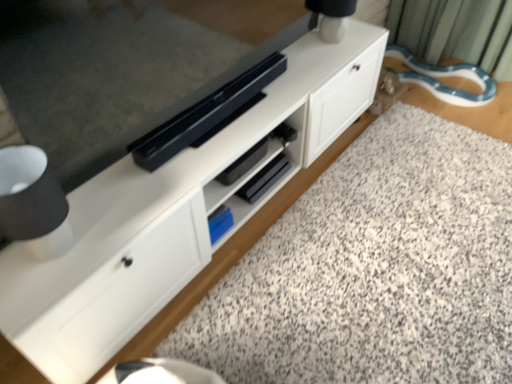
Identify the location of granite at lower center. (375, 270).

Identify the location of white matte cabinet at center. The image size is (512, 384). (178, 195).

What is the approximate width of white matte cabinet at center?

45.25 centimeters.

Describe the element at coordinates (332, 17) in the screenshot. The height and width of the screenshot is (384, 512). I see `white matte table lamp at upper right` at that location.

I want to click on granite at lower center, so click(375, 270).

Considering the relative sizes of granite at lower center and white matte cabinet at center in the image provided, is granite at lower center thinner than white matte cabinet at center?

Incorrect, the width of granite at lower center is not less than that of white matte cabinet at center.

Between granite at lower center and white matte cabinet at center, which one is positioned behind?

white matte cabinet at center.

Does granite at lower center appear on the left side of white matte cabinet at center?

In fact, granite at lower center is to the right of white matte cabinet at center.

Looking at this image, in terms of height, does granite at lower center look taller or shorter compared to white matte cabinet at center?

Considering their sizes, granite at lower center has less height than white matte cabinet at center.

Which of these two, white matte table lamp at upper right or granite at lower center, is bigger?

With larger size is granite at lower center.

Are white matte table lamp at upper right and granite at lower center beside each other?

They are not placed beside each other.

Does white matte table lamp at upper right have a lesser width compared to granite at lower center?

Yes.

You are a GUI agent. You are given a task and a screenshot of the screen. Output one action in this format:
    pyautogui.click(x=<x>, y=<y>)
    Task: Click on the granite in front of the white matte table lamp at upper right
    
    Given the screenshot: What is the action you would take?
    pyautogui.click(x=375, y=270)

Would you say granite at lower center is outside white matte table lamp at upper right?

Yes, granite at lower center is outside of white matte table lamp at upper right.

From a real-world perspective, is granite at lower center on top of white matte table lamp at upper right?

No, from a real-world perspective, granite at lower center is not above white matte table lamp at upper right.

Is granite at lower center at the right side of white matte table lamp at upper right?

Yes, granite at lower center is to the right of white matte table lamp at upper right.

Are white matte cabinet at center and white matte table lamp at upper right making contact?

white matte cabinet at center and white matte table lamp at upper right are not in contact.

Is white matte cabinet at center oriented towards white matte table lamp at upper right?

No, white matte cabinet at center is not turned towards white matte table lamp at upper right.

Which of these two, white matte cabinet at center or white matte table lamp at upper right, is wider?

white matte cabinet at center is wider.

Is white matte table lamp at upper right inside white matte cabinet at center?

Definitely not — white matte table lamp at upper right is not inside white matte cabinet at center.

From the picture: Could you tell me if white matte cabinet at center is facing granite at lower center?

Yes, white matte cabinet at center faces towards granite at lower center.

Could granite at lower center be considered to be inside white matte cabinet at center?

No, granite at lower center is not surrounded by white matte cabinet at center.

Is white matte cabinet at center in front of or behind granite at lower center in the image?

Visually, white matte cabinet at center is located behind granite at lower center.

In the image, there is a white matte cabinet at center. Where is `table lamp above it (from the image's perspective)`? This screenshot has height=384, width=512. table lamp above it (from the image's perspective) is located at coordinates (332, 17).

Which of these two, white matte table lamp at upper right or white matte cabinet at center, is smaller?

white matte table lamp at upper right is smaller.

In the image, is white matte table lamp at upper right positioned in front of or behind white matte cabinet at center?

white matte table lamp at upper right is behind white matte cabinet at center.

At what (x,y) coordinates should I click in order to perform the action: click on granite that appears below the white matte cabinet at center (from a real-world perspective). Please return your answer as a coordinate pair (x, y). Looking at the image, I should click on (375, 270).

Where is `granite located on the right of white matte table lamp at upper right`? The image size is (512, 384). granite located on the right of white matte table lamp at upper right is located at coordinates (375, 270).

Estimate the real-world distances between objects in this image. Which object is further from white matte table lamp at upper right, white matte cabinet at center or granite at lower center?

granite at lower center.

From the image, which object appears to be nearer to white matte cabinet at center, white matte table lamp at upper right or granite at lower center?

The object closer to white matte cabinet at center is granite at lower center.

From the image, which object appears to be nearer to granite at lower center, white matte table lamp at upper right or white matte cabinet at center?

Based on the image, white matte cabinet at center appears to be nearer to granite at lower center.

Estimate the real-world distances between objects in this image. Which object is further from granite at lower center, white matte cabinet at center or white matte table lamp at upper right?

white matte table lamp at upper right is further to granite at lower center.

Estimate the real-world distances between objects in this image. Which object is further from white matte table lamp at upper right, granite at lower center or white matte cabinet at center?

Among the two, granite at lower center is located further to white matte table lamp at upper right.

Based on the photo, based on their spatial positions, is granite at lower center or white matte table lamp at upper right closer to white matte cabinet at center?

granite at lower center.

Find the location of a particular element. cabinetry that lies between white matte table lamp at upper right and granite at lower center from top to bottom is located at coordinates (178, 195).